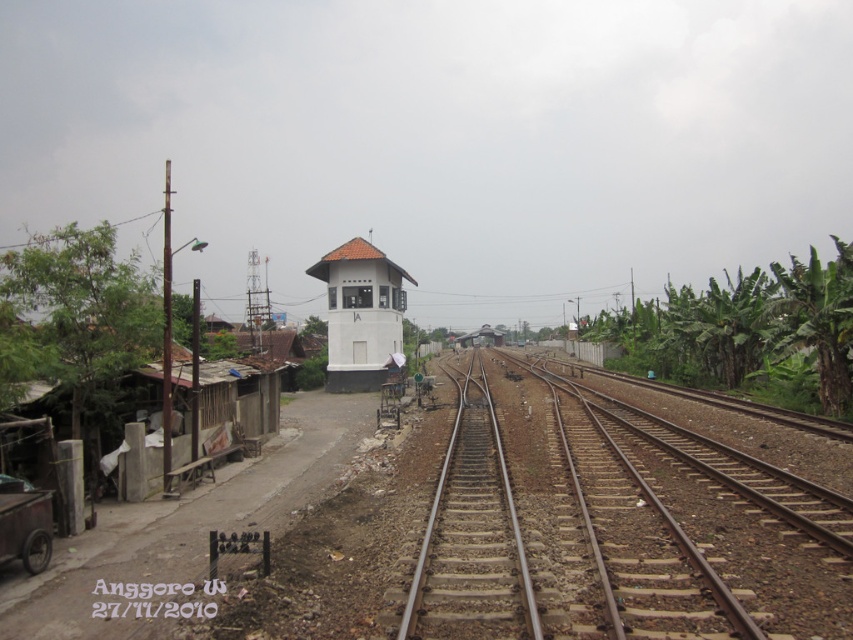
Is point (550, 426) closer to camera compared to point (469, 333)?

Yes, point (550, 426) is closer to viewer.

Between brown metal train track at center and metallic silver train at center, which one has more height?

metallic silver train at center

Is point (846, 588) behind point (483, 324)?

No, it is in front of (483, 324).

Find the location of a particular element. This screenshot has width=853, height=640. brown metal train track at center is located at coordinates (619, 528).

Describe the element at coordinates (619, 528) in the screenshot. I see `brown metal train track at center` at that location.

Between brown metal train track at center and white matte water tower at center, which one appears on the right side from the viewer's perspective?

brown metal train track at center is more to the right.

Which is in front, point (683, 602) or point (343, 356)?

Point (683, 602) is more forward.

Image resolution: width=853 pixels, height=640 pixels. Identify the location of brown metal train track at center. (619, 528).

Between white matte water tower at center and metallic silver train at center, which one appears on the left side from the viewer's perspective?

From the viewer's perspective, white matte water tower at center appears more on the left side.

Which is behind, point (386, 276) or point (498, 337)?

The point (498, 337) is more distant.

Locate an element on the screen. white matte water tower at center is located at coordinates (360, 314).